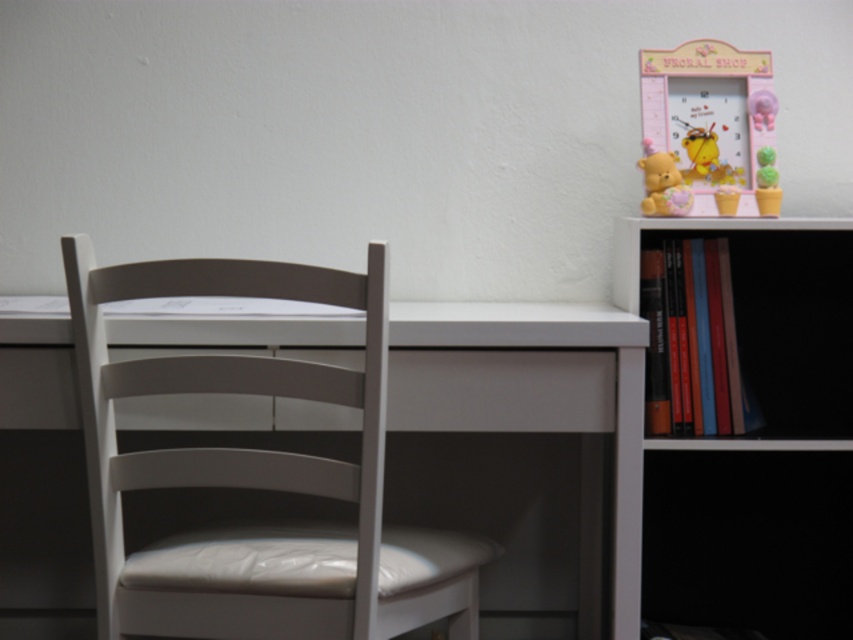
You are a delivery person who just arrived with a package for the office. The package is 20 inches wide and needs to be placed between the white leather chair at left and the matte plastic bear at upper right. Is there enough space between them to fit the package?

The white leather chair at left and matte plastic bear at upper right are 31.17 inches apart from each other. Since the package is 20 inches wide, there is enough space between them to fit the package as 31.17 inches is greater than 20 inches.

You are standing in front of the desk in the workspace scene. If you look towards the white leather chair at left, where would you expect to find it relative to your position?

The white leather chair at left is located at the left side of the desk, so if you are standing in front of the desk, the white leather chair at left would be to your left.

You are standing in front of the desk and want to move from the white leather chair at left to the white matte bookshelf at right. Which direction should you move first?

You should move towards the right direction first to go from the white leather chair at left to the white matte bookshelf at right.